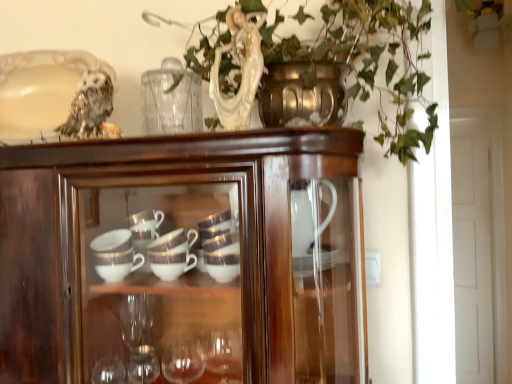
I want to click on sparkly silver owl at upper left, so click(89, 106).

The width and height of the screenshot is (512, 384). Describe the element at coordinates (184, 260) in the screenshot. I see `glossy wood cupboard at center` at that location.

Find the location of a particular element. This screenshot has height=384, width=512. sparkly silver owl at upper left is located at coordinates (89, 106).

Is white glossy door at right inside the boundaries of sparkly silver owl at upper left, or outside?

white glossy door at right cannot be found inside sparkly silver owl at upper left.

Considering the sizes of objects white glossy door at right and sparkly silver owl at upper left in the image provided, who is wider, white glossy door at right or sparkly silver owl at upper left?

Wider between the two is sparkly silver owl at upper left.

From the picture: Is sparkly silver owl at upper left wider or thinner than white glossy door at right?

In the image, sparkly silver owl at upper left appears to be wider than white glossy door at right.

From a real-world perspective, is sparkly silver owl at upper left on top of white glossy door at right?

Correct, in the physical world, sparkly silver owl at upper left is higher than white glossy door at right.

Is the position of sparkly silver owl at upper left more distant than that of white glossy door at right?

No, the depth of sparkly silver owl at upper left is less than that of white glossy door at right.

From the image's perspective, which is above, sparkly silver owl at upper left or white glossy door at right?

sparkly silver owl at upper left, from the image's perspective.

Can you confirm if sparkly silver owl at upper left is wider than glossy wood cupboard at center?

In fact, sparkly silver owl at upper left might be narrower than glossy wood cupboard at center.

Considering the sizes of sparkly silver owl at upper left and glossy wood cupboard at center in the image, is sparkly silver owl at upper left bigger or smaller than glossy wood cupboard at center?

In the image, sparkly silver owl at upper left appears to be smaller than glossy wood cupboard at center.

Which object is further away from the camera, sparkly silver owl at upper left or glossy wood cupboard at center?

sparkly silver owl at upper left is more distant.

Is sparkly silver owl at upper left aimed at glossy wood cupboard at center?

No.

Is white glossy door at right surrounded by glossy wood cupboard at center?

No, white glossy door at right is not inside glossy wood cupboard at center.

Is glossy wood cupboard at center smaller than white glossy door at right?

Incorrect, glossy wood cupboard at center is not smaller in size than white glossy door at right.

Is glossy wood cupboard at center thinner than white glossy door at right?

Incorrect, the width of glossy wood cupboard at center is not less than that of white glossy door at right.

Could you tell me if glossy wood cupboard at center is turned towards white glossy door at right?

No, glossy wood cupboard at center is not oriented towards white glossy door at right.

How different are the orientations of glossy wood cupboard at center and sparkly silver owl at upper left in degrees?

There is a 3.21-degree angle between the facing directions of glossy wood cupboard at center and sparkly silver owl at upper left.

Between glossy wood cupboard at center and sparkly silver owl at upper left, which one has less height?

sparkly silver owl at upper left.

Considering the points (50, 364) and (71, 104), which point is behind, point (50, 364) or point (71, 104)?

The point (71, 104) is behind.

How many degrees apart are the facing directions of white glossy door at right and glossy wood cupboard at center?

36 degrees separate the facing orientations of white glossy door at right and glossy wood cupboard at center.

Considering the sizes of objects white glossy door at right and glossy wood cupboard at center in the image provided, who is taller, white glossy door at right or glossy wood cupboard at center?

white glossy door at right.

Considering the sizes of objects white glossy door at right and glossy wood cupboard at center in the image provided, who is smaller, white glossy door at right or glossy wood cupboard at center?

white glossy door at right.

From the image's perspective, would you say white glossy door at right is positioned over glossy wood cupboard at center?

No, from the image's perspective, white glossy door at right is not over glossy wood cupboard at center.

Locate an element on the screen. owl that appears on the left of white glossy door at right is located at coordinates (89, 106).

At what (x,y) coordinates should I click in order to perform the action: click on glass door below the sparkly silver owl at upper left (from the image's perspective). Please return your answer as a coordinate pair (x, y). This screenshot has height=384, width=512. Looking at the image, I should click on click(477, 243).

Considering their positions, is white glossy door at right positioned closer to sparkly silver owl at upper left than glossy wood cupboard at center?

glossy wood cupboard at center is positioned closer to the anchor sparkly silver owl at upper left.

Estimate the real-world distances between objects in this image. Which object is closer to sparkly silver owl at upper left, glossy wood cupboard at center or white glossy door at right?

glossy wood cupboard at center is positioned closer to the anchor sparkly silver owl at upper left.

Looking at the image, which one is located closer to glossy wood cupboard at center, white glossy door at right or sparkly silver owl at upper left?

sparkly silver owl at upper left lies closer to glossy wood cupboard at center than the other object.

Estimate the real-world distances between objects in this image. Which object is further from glossy wood cupboard at center, sparkly silver owl at upper left or white glossy door at right?

white glossy door at right.

From the image, which object appears to be nearer to white glossy door at right, glossy wood cupboard at center or sparkly silver owl at upper left?

Based on the image, glossy wood cupboard at center appears to be nearer to white glossy door at right.

In the scene shown: Estimate the real-world distances between objects in this image. Which object is closer to white glossy door at right, sparkly silver owl at upper left or glossy wood cupboard at center?

Based on the image, glossy wood cupboard at center appears to be nearer to white glossy door at right.

Locate an element on the screen. The image size is (512, 384). owl positioned between glossy wood cupboard at center and white glossy door at right from near to far is located at coordinates (89, 106).